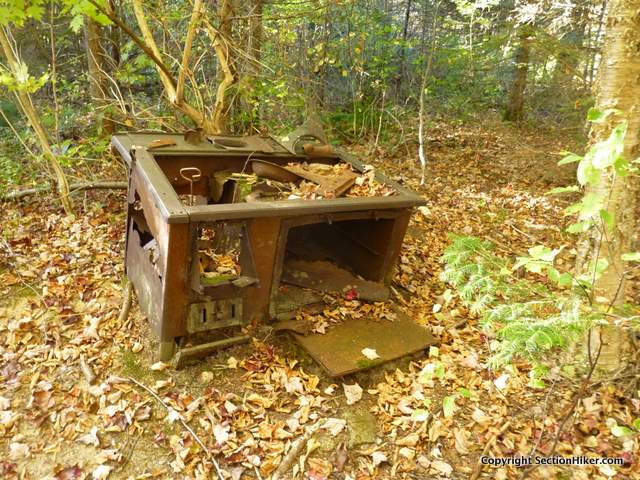
You are a GUI agent. You are given a task and a screenshot of the screen. Output one action in this format:
    pyautogui.click(x=<x>, y=<y>)
    Task: Click on the door
    Image resolution: width=640 pixels, height=480 pixels.
    Given the screenshot: What is the action you would take?
    pyautogui.click(x=386, y=347)